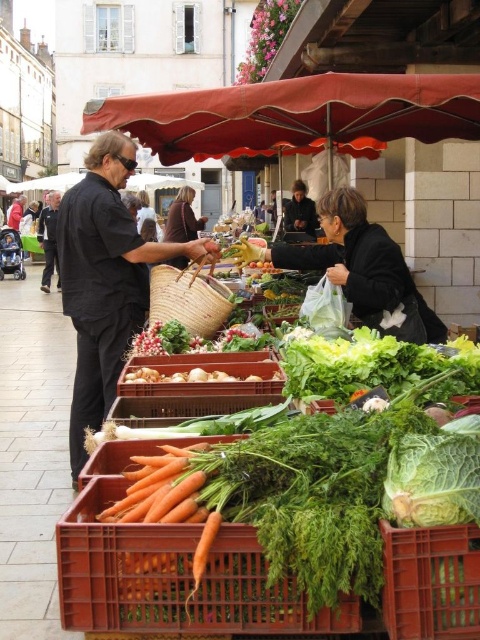
Does green plastic crate at lower center have a greater width compared to smooth black jacket at center?

In fact, green plastic crate at lower center might be narrower than smooth black jacket at center.

Can you confirm if green plastic crate at lower center is shorter than smooth black jacket at center?

Yes, green plastic crate at lower center is shorter than smooth black jacket at center.

Where is `green plastic crate at lower center`? Image resolution: width=480 pixels, height=640 pixels. green plastic crate at lower center is located at coordinates (431, 580).

Does point (227, 564) come farther from viewer compared to point (56, 192)?

No, it is not.

Measure the distance from orange plastic crate of carrots at center to dark gray suit at center.

The distance of orange plastic crate of carrots at center from dark gray suit at center is 29.95 meters.

Between point (211, 579) and point (54, 257), which one is positioned behind?

Positioned behind is point (54, 257).

Identify the location of orange plastic crate of carrots at center. (173, 579).

At what (x,y) coordinates should I click in order to perform the action: click on orange plastic crate of carrots at center. Please return your answer as a coordinate pair (x, y). This screenshot has width=480, height=640. Looking at the image, I should click on (173, 579).

What do you see at coordinates (173, 579) in the screenshot? The width and height of the screenshot is (480, 640). I see `orange plastic crate of carrots at center` at bounding box center [173, 579].

Locate an element on the screen. The width and height of the screenshot is (480, 640). orange plastic crate of carrots at center is located at coordinates (173, 579).